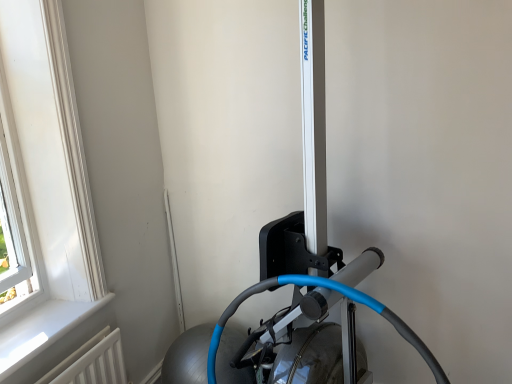
Question: Relative to silver metallic rowing machine at center, arranged as the 1th sport equipment when viewed from the top, is white plastic window at upper left in front or behind?

Choices:
 (A) front
 (B) behind

Answer: (B)

Question: From the image's perspective, is white plastic window at upper left located above or below silver metallic rowing machine at center, the second sport equipment ordered from the bottom?

Choices:
 (A) above
 (B) below

Answer: (A)

Question: Considering the real-world distances, which object is closest to the white plastic window at upper left?

Choices:
 (A) black rubber rowing machine at center, which is the first sport equipment from bottom to top
 (B) white painted wood at lower left
 (C) silver metallic rowing machine at center, arranged as the 1th sport equipment when viewed from the top

Answer: (B)

Question: Which object is the closest to the white plastic window at upper left?

Choices:
 (A) white painted wood at lower left
 (B) black rubber rowing machine at center, which is the first sport equipment from bottom to top
 (C) silver metallic rowing machine at center, the second sport equipment ordered from the bottom

Answer: (A)